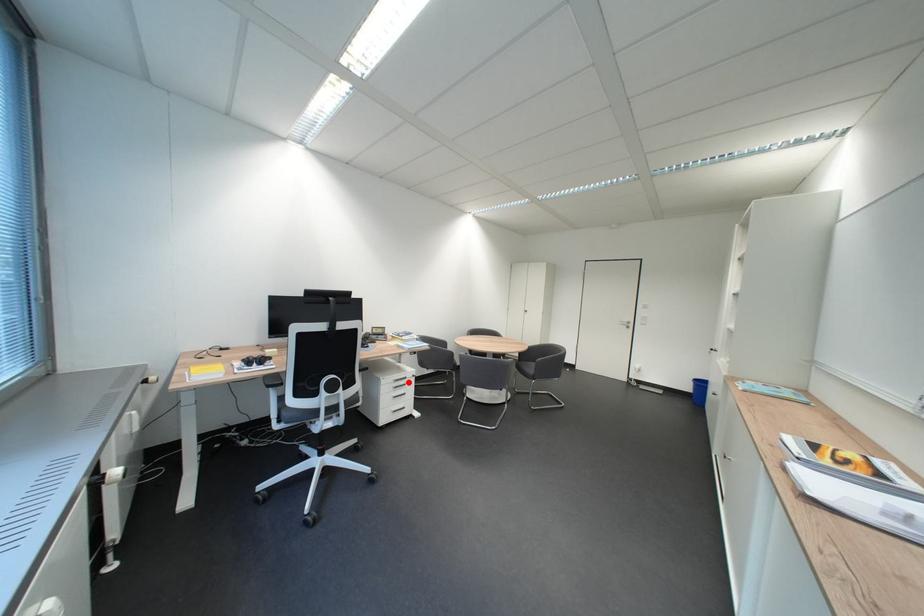
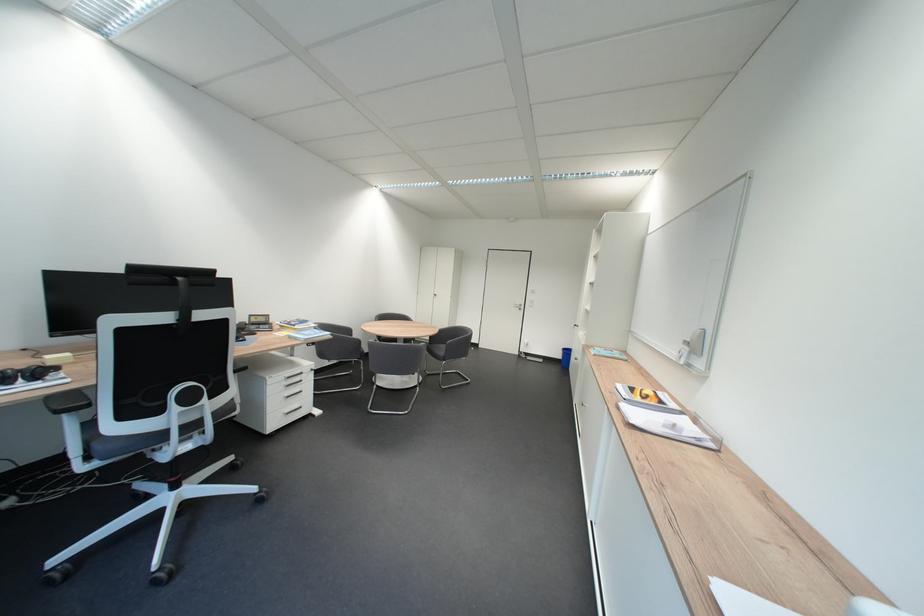
Question: I am providing you with two images of the same scene from different viewpoints. A red point is marked on the first image. Can you still see the location of the red point in image 2?

Choices:
 (A) Yes
 (B) No

Answer: (A)